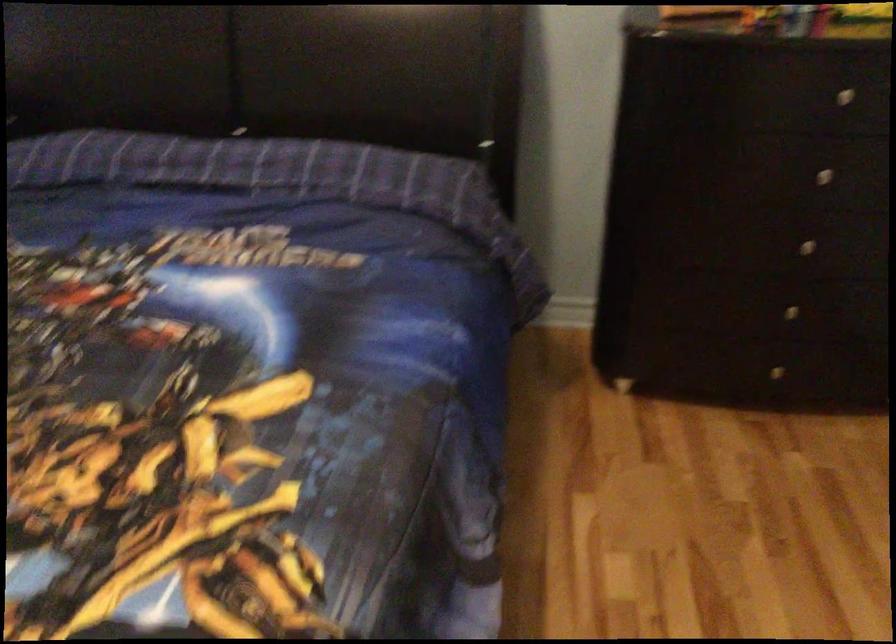
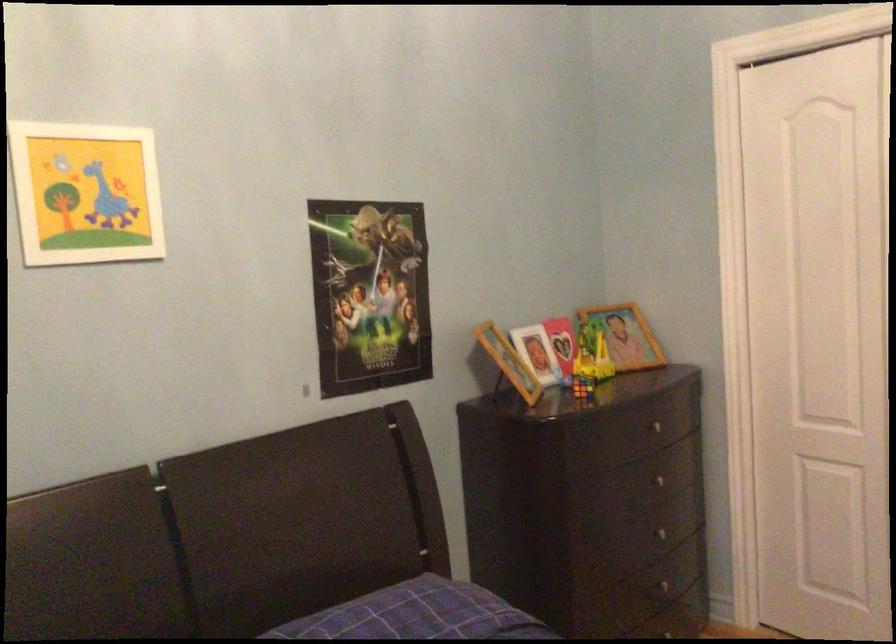
The point at (814, 167) is marked in the first image. Where is the corresponding point in the second image?

(656, 480)